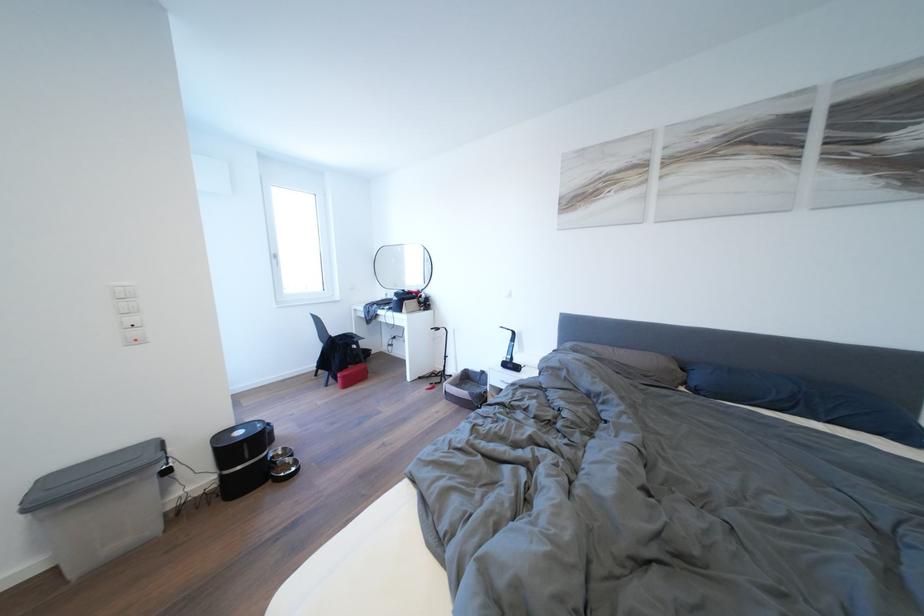
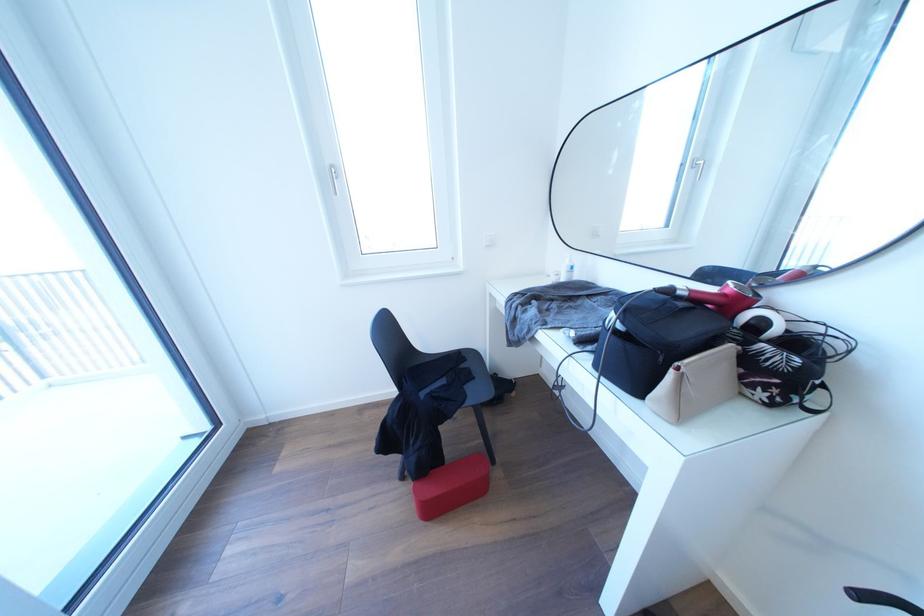
Locate, in the second image, the point that corresponds to [411,294] in the first image.

(675, 296)